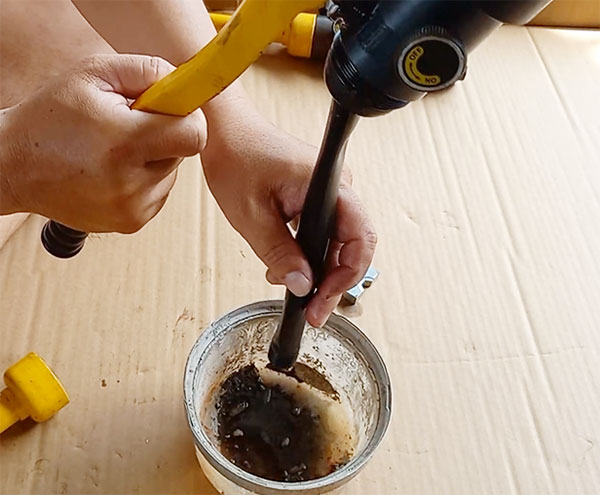
Locate an element on the screen. on and off switch is located at coordinates (418, 74).